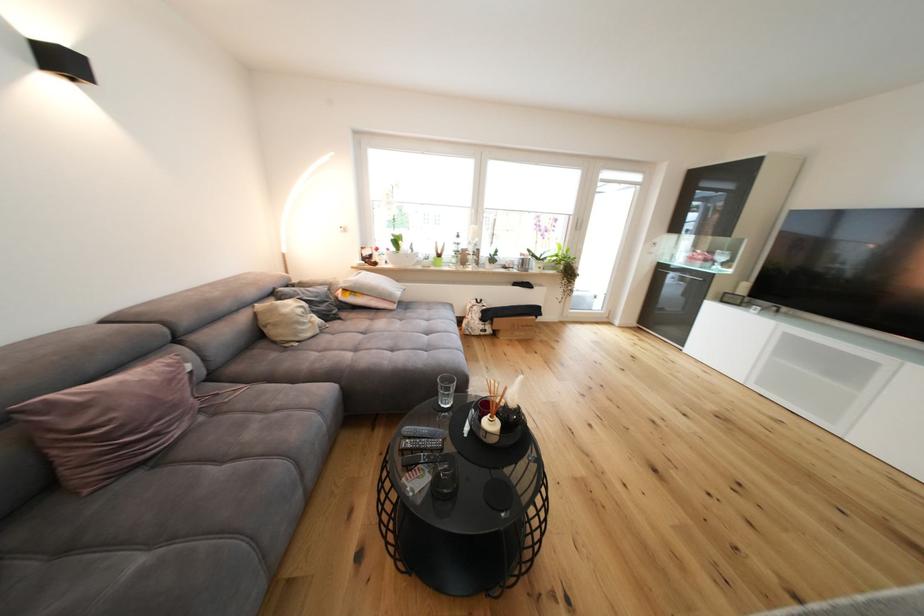
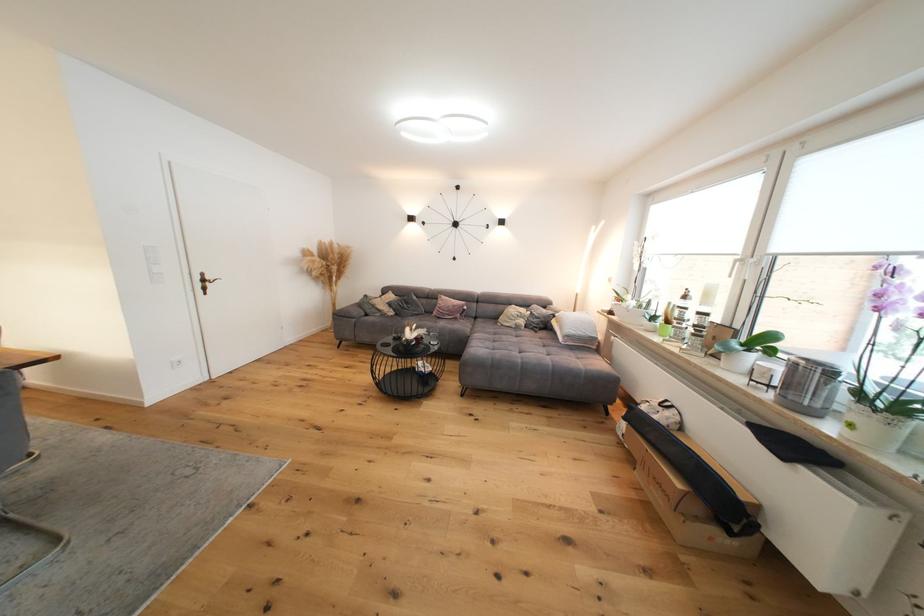
Find the pixel in the second image that matches point 82,456 in the first image.

(444, 310)